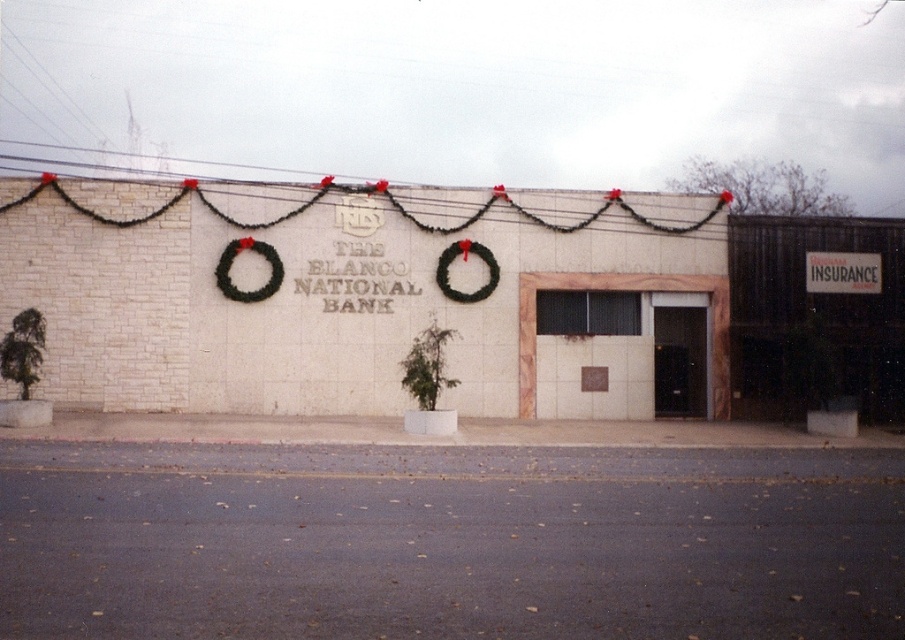
Question: Which point is closer to the camera taking this photo?

Choices:
 (A) (241, 237)
 (B) (452, 291)

Answer: (A)

Question: Does green leafy wreath at upper center appear on the left side of green leafy wreath at center?

Choices:
 (A) no
 (B) yes

Answer: (B)

Question: Can you confirm if green leafy wreath at upper center is positioned above green leafy wreath at center?

Choices:
 (A) no
 (B) yes

Answer: (A)

Question: Does green leafy wreath at upper center appear on the left side of green leafy wreath at center?

Choices:
 (A) yes
 (B) no

Answer: (A)

Question: Which of the following is the farthest from the observer?

Choices:
 (A) green leafy wreath at center
 (B) green leafy wreath at upper center

Answer: (A)